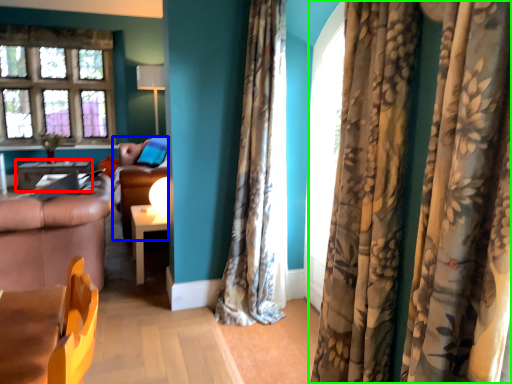
Question: Which is farther away from table (highlighted by a red box)? couch (highlighted by a blue box) or curtain (highlighted by a green box)?

Choices:
 (A) couch
 (B) curtain

Answer: (B)